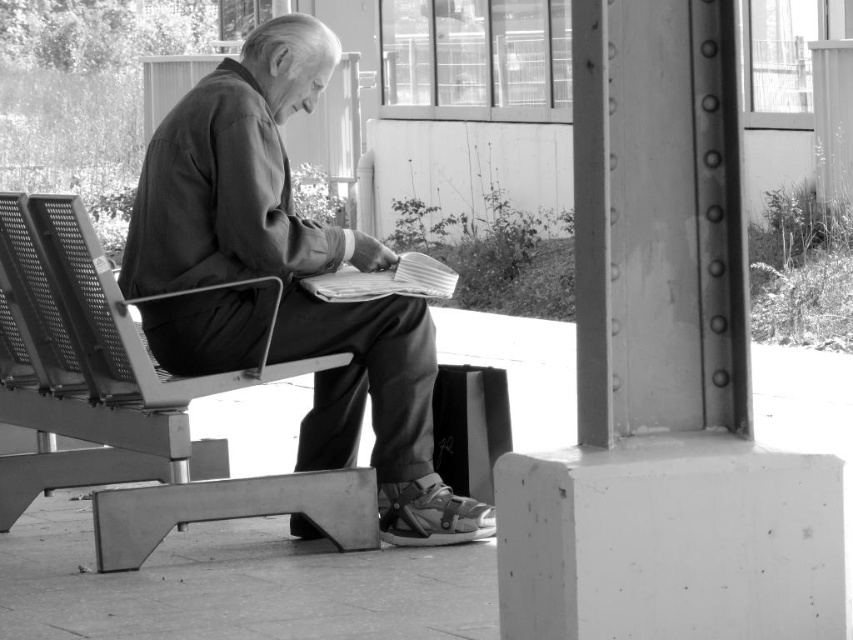
You are a photographer trying to capture the matte black jacket at center and the metallic mesh chair at left in the same frame. Can you determine which object is covering part of the other?

The matte black jacket at center is positioned over the metallic mesh chair at left, so the jacket is covering part of the chair.

You are standing in the covered outdoor area and want to place a small potted plant between the two points marked as point (398, 358) and point (122, 364). Which point should the plant be closer to in order to be closer to the viewer?

The plant should be closer to point (398, 358) because it is further to the viewer than point (122, 364).